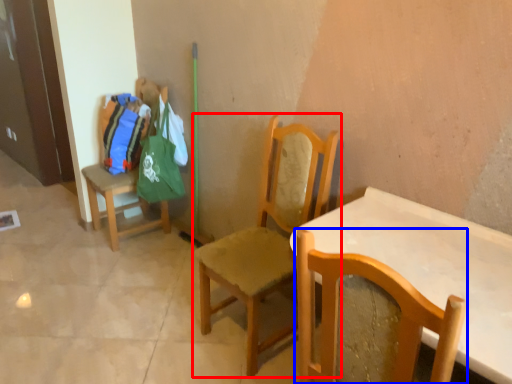
Question: Which of the following is the farthest to the observer, chair (highlighted by a red box) or chair (highlighted by a blue box)?

Choices:
 (A) chair
 (B) chair

Answer: (A)